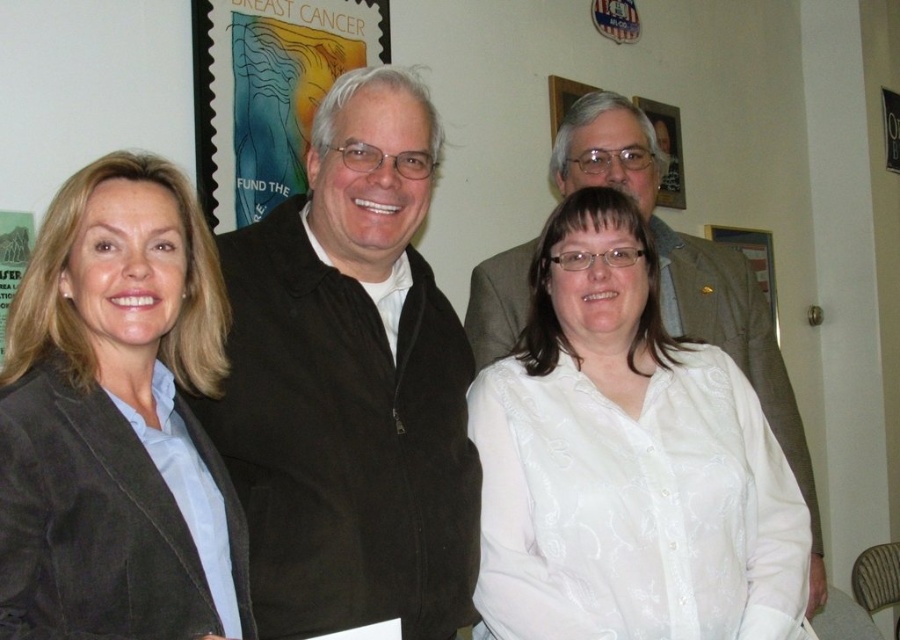
Question: Which point is farther from the camera taking this photo?

Choices:
 (A) (92, 451)
 (B) (364, 417)
 (C) (762, 429)

Answer: (C)

Question: Is black corduroy jacket at center further to camera compared to white satin blouse at center?

Choices:
 (A) yes
 (B) no

Answer: (B)

Question: Estimate the real-world distances between objects in this image. Which object is farther from the suede jacket at left?

Choices:
 (A) breast cancer awareness poster at upper left
 (B) black corduroy jacket at center

Answer: (A)

Question: Does black corduroy jacket at center appear over breast cancer awareness poster at upper left?

Choices:
 (A) no
 (B) yes

Answer: (A)

Question: Is white satin blouse at center bigger than suede jacket at left?

Choices:
 (A) yes
 (B) no

Answer: (A)

Question: Among these points, which one is nearest to the camera?

Choices:
 (A) (281, 60)
 (B) (237, 381)
 (C) (498, 362)
 (D) (110, 595)

Answer: (D)